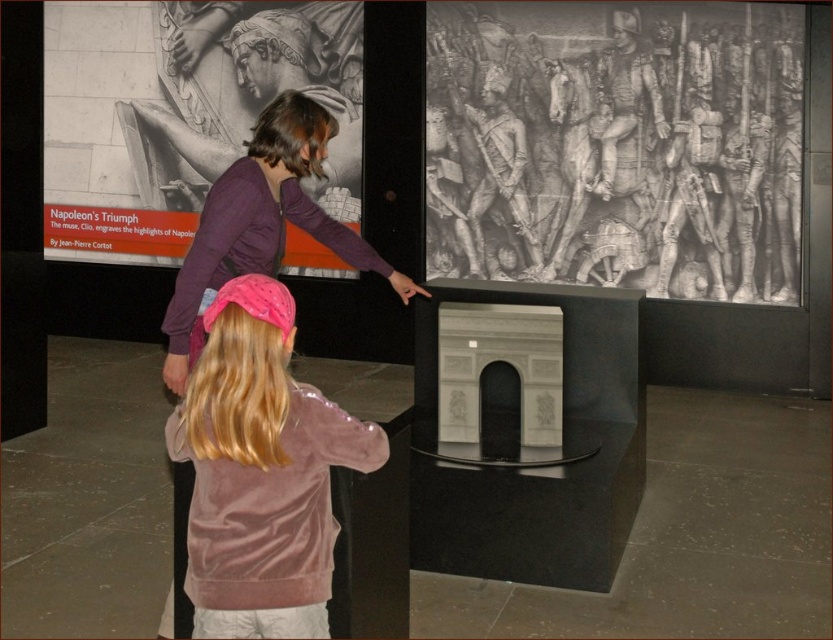
You are a museum visitor standing in front of the display. You notice the velvet pink jacket at lower center and the pink velvet headband at upper center. Which object is closer to you from your current position?

The velvet pink jacket at lower center is closer to you because it is in front of the pink velvet headband at upper center.

You are standing in the museum and want to take a photo of the point at coordinates [205,426]. The camera you have can focus on objects within 5 feet. Will the point be in focus?

The point at coordinates [205,426] is 6.09 feet from the camera, which is beyond the camera focus range of 5 feet. Therefore, the point will not be in focus.

You are an art student analyzing the museum display. You notice the matte gray stone arch at upper center and the pink velvet headband at upper center. Which object is positioned higher in the image?

The matte gray stone arch at upper center is much taller than the pink velvet headband at upper center, so the matte gray stone arch at upper center is positioned higher in the image.